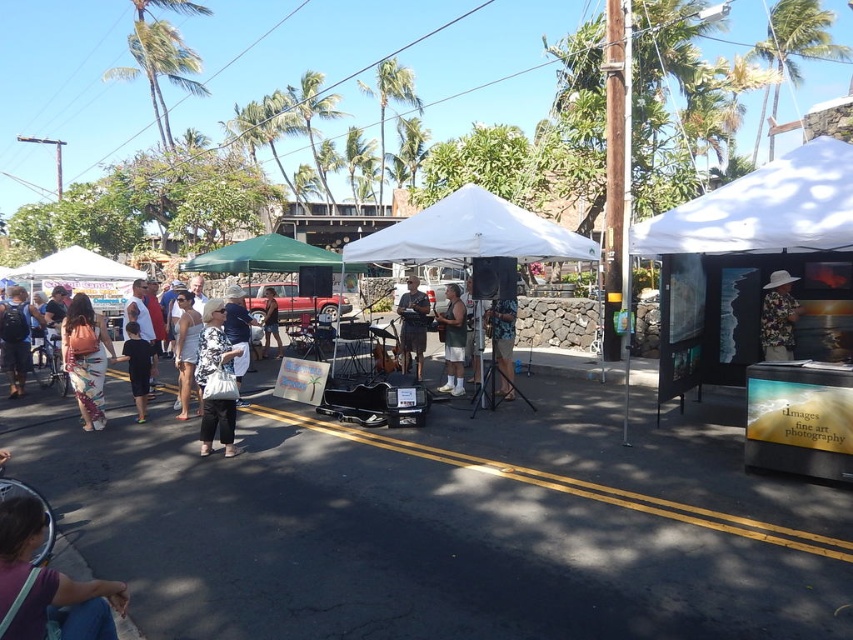
Who is more forward, (450, 300) or (407, 314)?

Point (450, 300) is more forward.

Is metallic silver guitar at center below matte gray shirt at center?

Yes, metallic silver guitar at center is below matte gray shirt at center.

Which is in front, point (440, 387) or point (421, 336)?

Point (440, 387) is in front.

I want to click on metallic silver guitar at center, so click(x=453, y=340).

Can you confirm if white fabric canopy at center is smaller than white fabric dress at center?

Yes, white fabric canopy at center is smaller than white fabric dress at center.

The height and width of the screenshot is (640, 853). What do you see at coordinates (469, 234) in the screenshot?
I see `white fabric canopy at center` at bounding box center [469, 234].

Locate an element on the screen. The image size is (853, 640). white fabric canopy at center is located at coordinates (469, 234).

Is point (378, 256) less distant than point (199, 314)?

No, (378, 256) is further to viewer.

Can you confirm if white fabric tent at center is positioned to the left of white fabric dress at center?

No, white fabric tent at center is not to the left of white fabric dress at center.

Does point (589, 256) lie in front of point (181, 349)?

No, (589, 256) is further to viewer.

This screenshot has height=640, width=853. In order to click on white fabric tent at center in this screenshot , I will do `click(469, 234)`.